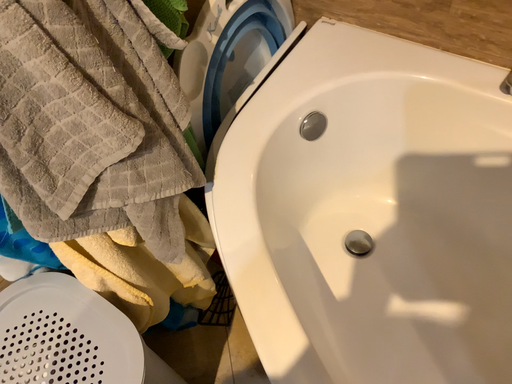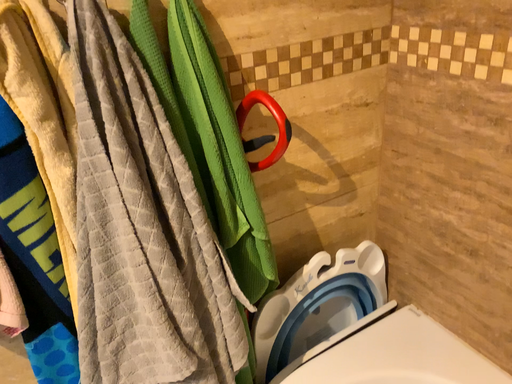
Question: Which way did the camera rotate in the video?

Choices:
 (A) rotated right
 (B) rotated left

Answer: (B)